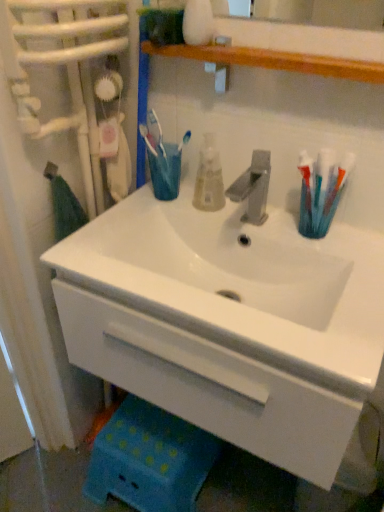
Question: From their relative heights in the image, would you say white glossy sink at center is taller or shorter than translucent plastic mouthwash at center?

Choices:
 (A) short
 (B) tall

Answer: (B)

Question: Is white glossy sink at center in front of or behind translucent plastic mouthwash at center in the image?

Choices:
 (A) behind
 (B) front

Answer: (B)

Question: Which object is the closest to the translucent plastic toothbrushes at right?

Choices:
 (A) white glossy sink at center
 (B) translucent plastic mouthwash at center
 (C) translucent plastic cup at center

Answer: (B)

Question: Based on their relative distances, which object is nearer to the translucent plastic cup at center?

Choices:
 (A) translucent plastic mouthwash at center
 (B) translucent plastic toothbrushes at right
 (C) white glossy sink at center

Answer: (A)